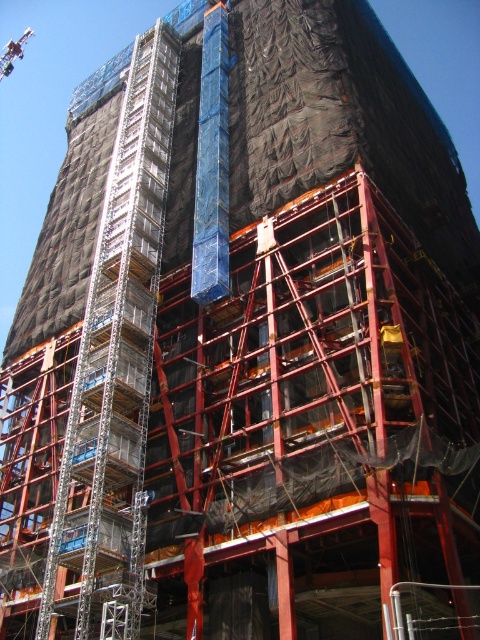
You are a construction worker standing at the entrance of the building. You need to locate the metallic scaffolding at left. Where exactly is it located in the image?

The metallic scaffolding at left is located at point [117,360] in the image.

You are an inspector checking the construction site. You need to determine if the metallic scaffolding at left can fit within the space allocated for it, which is the same width as the metallic red crane at upper left. Can it fit?

The metallic scaffolding at left is narrower than the metallic red crane at upper left, so it can fit within the allocated space.